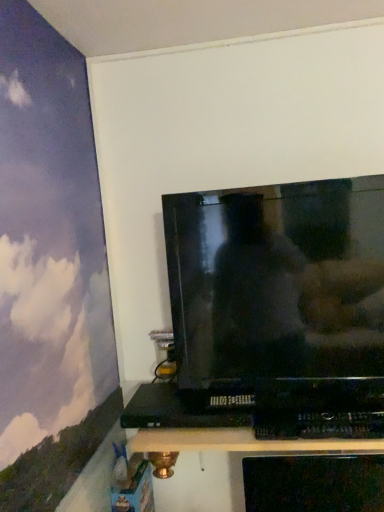
Identify the location of vacant point above purple matte wall at upper left (from a real-world perspective). The height and width of the screenshot is (512, 384). (59, 19).